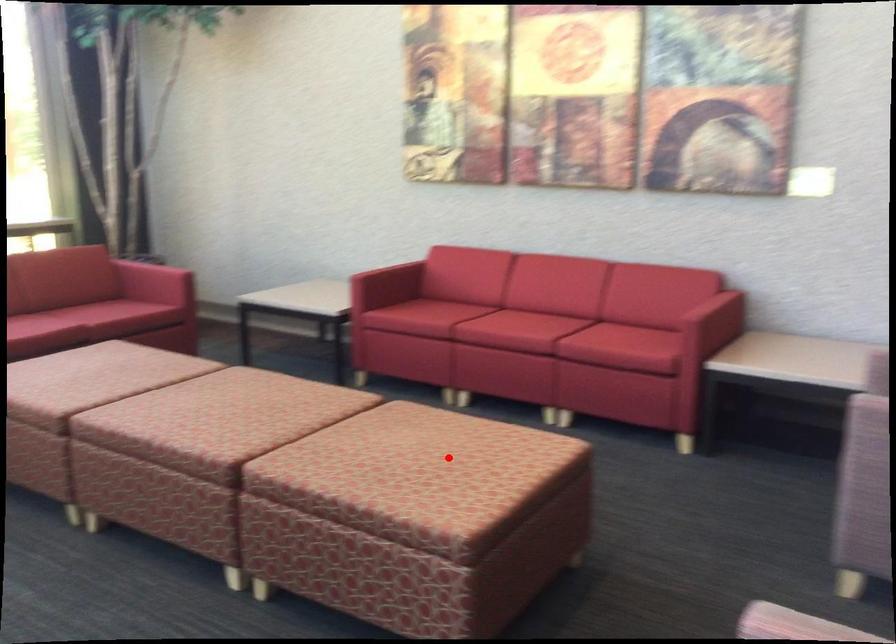
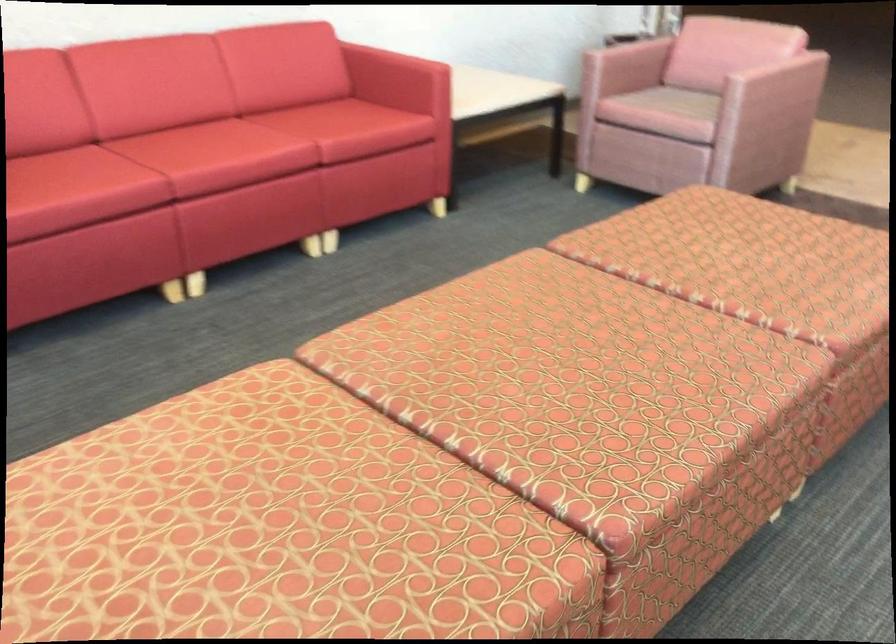
Locate, in the second image, the point that corresponds to the highlighted location in the first image.

(762, 245)